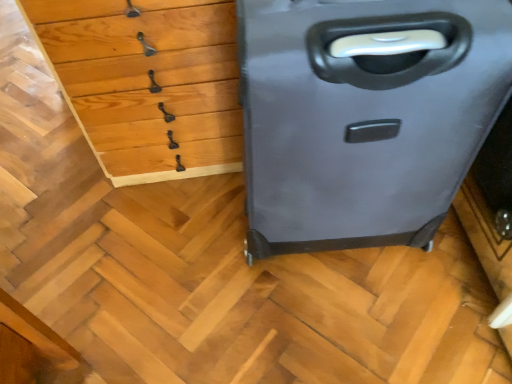
What is the approximate height of matte gray suitcase at right?

matte gray suitcase at right is 25.99 inches tall.

Where is `matte gray suitcase at right`? The width and height of the screenshot is (512, 384). matte gray suitcase at right is located at coordinates (364, 116).

The width and height of the screenshot is (512, 384). What do you see at coordinates (364, 116) in the screenshot? I see `matte gray suitcase at right` at bounding box center [364, 116].

Measure the distance between point (163,34) and camera.

The depth of point (163,34) is 33.19 inches.

Image resolution: width=512 pixels, height=384 pixels. What do you see at coordinates (147, 83) in the screenshot? I see `wooden chest of drawers at upper left` at bounding box center [147, 83].

This screenshot has height=384, width=512. Identify the location of wooden chest of drawers at upper left. [147, 83].

You are a GUI agent. You are given a task and a screenshot of the screen. Output one action in this format:
    pyautogui.click(x=<x>, y=<y>)
    Task: Click on the matte gray suitcase at right
    The height and width of the screenshot is (384, 512).
    Given the screenshot: What is the action you would take?
    pyautogui.click(x=364, y=116)

Considering the relative positions of wooden chest of drawers at upper left and matte gray suitcase at right in the image provided, is wooden chest of drawers at upper left to the right of matte gray suitcase at right from the viewer's perspective?

In fact, wooden chest of drawers at upper left is to the left of matte gray suitcase at right.

Is wooden chest of drawers at upper left behind matte gray suitcase at right?

Yes, it is behind matte gray suitcase at right.

Between point (72, 51) and point (340, 184), which one is positioned in front?

Positioned in front is point (340, 184).

From the image's perspective, is wooden chest of drawers at upper left above matte gray suitcase at right?

Yes, from the image's perspective, wooden chest of drawers at upper left is over matte gray suitcase at right.

From a real-world perspective, relative to matte gray suitcase at right, is wooden chest of drawers at upper left vertically above or below?

wooden chest of drawers at upper left is below matte gray suitcase at right.

Which object is thinner, wooden chest of drawers at upper left or matte gray suitcase at right?

With smaller width is matte gray suitcase at right.

Based on the photo, between wooden chest of drawers at upper left and matte gray suitcase at right, which one has less height?

With less height is wooden chest of drawers at upper left.

Does wooden chest of drawers at upper left have a smaller size compared to matte gray suitcase at right?

No, wooden chest of drawers at upper left is not smaller than matte gray suitcase at right.

Is wooden chest of drawers at upper left inside the boundaries of matte gray suitcase at right, or outside?

wooden chest of drawers at upper left is not inside matte gray suitcase at right, it's outside.

Are wooden chest of drawers at upper left and matte gray suitcase at right located far from each other?

wooden chest of drawers at upper left is actually quite close to matte gray suitcase at right.

Is wooden chest of drawers at upper left looking in the opposite direction of matte gray suitcase at right?

No.

How much distance is there between wooden chest of drawers at upper left and matte gray suitcase at right?

wooden chest of drawers at upper left is 15.16 inches from matte gray suitcase at right.

Where is `file cabinet below the wooden chest of drawers at upper left (from the image's perspective)`? file cabinet below the wooden chest of drawers at upper left (from the image's perspective) is located at coordinates (364, 116).

Which is more to the left, matte gray suitcase at right or wooden chest of drawers at upper left?

From the viewer's perspective, wooden chest of drawers at upper left appears more on the left side.

Considering their positions, is matte gray suitcase at right located in front of or behind wooden chest of drawers at upper left?

In the image, matte gray suitcase at right appears in front of wooden chest of drawers at upper left.

Between point (373, 46) and point (93, 7), which one is positioned in front?

Positioned in front is point (373, 46).

From the image's perspective, is matte gray suitcase at right located above wooden chest of drawers at upper left?

Actually, matte gray suitcase at right appears below wooden chest of drawers at upper left in the image.

From a real-world perspective, is matte gray suitcase at right physically above wooden chest of drawers at upper left?

Yes.

Does matte gray suitcase at right have a greater width compared to wooden chest of drawers at upper left?

Incorrect, the width of matte gray suitcase at right does not surpass that of wooden chest of drawers at upper left.

Who is shorter, matte gray suitcase at right or wooden chest of drawers at upper left?

wooden chest of drawers at upper left is shorter.

Which of these two, matte gray suitcase at right or wooden chest of drawers at upper left, is smaller?

Smaller between the two is matte gray suitcase at right.

Is matte gray suitcase at right not inside wooden chest of drawers at upper left?

Yes, matte gray suitcase at right is located beyond the bounds of wooden chest of drawers at upper left.

Is matte gray suitcase at right next to wooden chest of drawers at upper left and touching it?

No, matte gray suitcase at right is not in contact with wooden chest of drawers at upper left.

Is matte gray suitcase at right facing away from wooden chest of drawers at upper left?

matte gray suitcase at right does not have its back to wooden chest of drawers at upper left.

The height and width of the screenshot is (384, 512). What are the coordinates of `chest of drawers behind the matte gray suitcase at right` in the screenshot? It's located at (147, 83).

At what (x,y) coordinates should I click in order to perform the action: click on chest of drawers below the matte gray suitcase at right (from a real-world perspective). Please return your answer as a coordinate pair (x, y). This screenshot has width=512, height=384. Looking at the image, I should click on (147, 83).

Where is `file cabinet to the right of wooden chest of drawers at upper left`? The image size is (512, 384). file cabinet to the right of wooden chest of drawers at upper left is located at coordinates (364, 116).